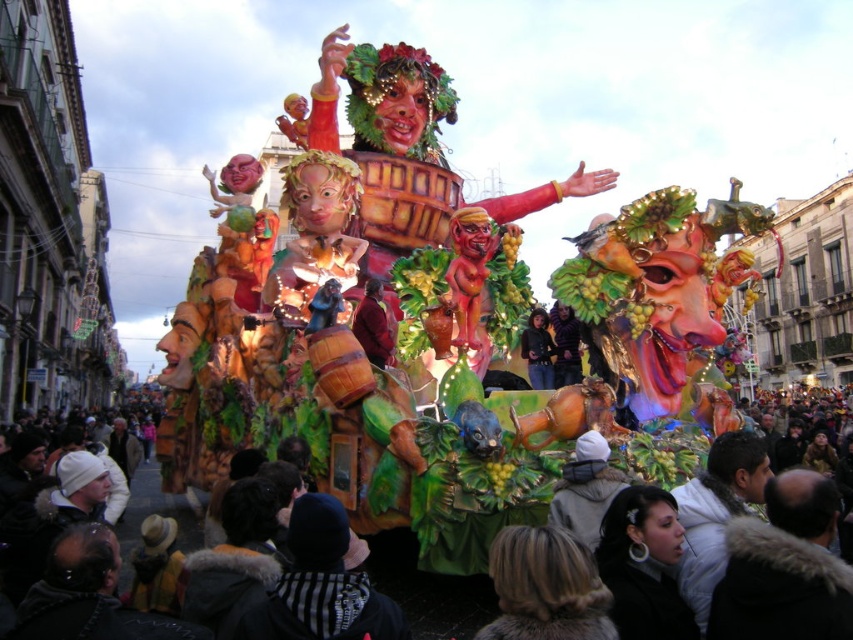
Question: Which object appears farthest from the camera in this image?

Choices:
 (A) dark brown fur coat at lower center
 (B) matte black jacket at center

Answer: (B)

Question: Among these points, which one is farthest from the camera?

Choices:
 (A) (550, 337)
 (B) (366, 282)
 (C) (431, 611)

Answer: (A)

Question: Does matte brown coat at center come behind matte black jacket at center?

Choices:
 (A) yes
 (B) no

Answer: (B)

Question: Considering the real-world distances, which object is closest to the matte brown coat at center?

Choices:
 (A) matte black jacket at center
 (B) dark brown fur coat at lower center

Answer: (A)

Question: In this image, where is dark brown fur coat at lower center located relative to matte brown coat at center?

Choices:
 (A) left
 (B) right

Answer: (B)

Question: In this image, where is dark brown fur coat at lower center located relative to matte brown coat at center?

Choices:
 (A) right
 (B) left

Answer: (A)